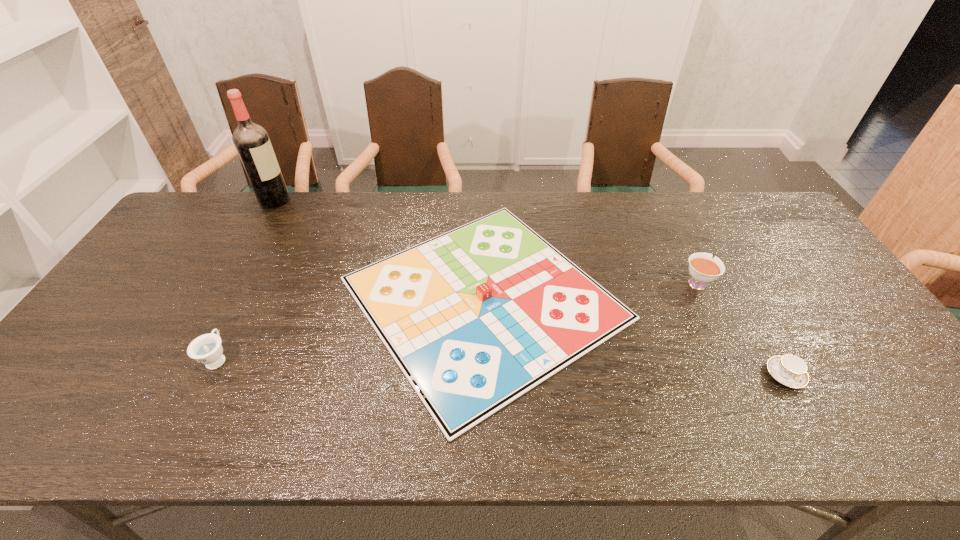
Where is `free space that satisfies the following two spatial constraints: 1. on the side of the third object from right to left with the handle; 2. on the right side of the third tallest object`? This screenshot has height=540, width=960. free space that satisfies the following two spatial constraints: 1. on the side of the third object from right to left with the handle; 2. on the right side of the third tallest object is located at coordinates (248, 298).

Find the location of a particular element. vacant space that satisfies the following two spatial constraints: 1. on the side of the farthest teacup with the handle; 2. on the front-facing side of the liquor is located at coordinates (657, 200).

What are the coordinates of `vacant space that satisfies the following two spatial constraints: 1. on the side of the tallest teacup with the handle; 2. on the front-facing side of the liquor` in the screenshot? It's located at (657, 200).